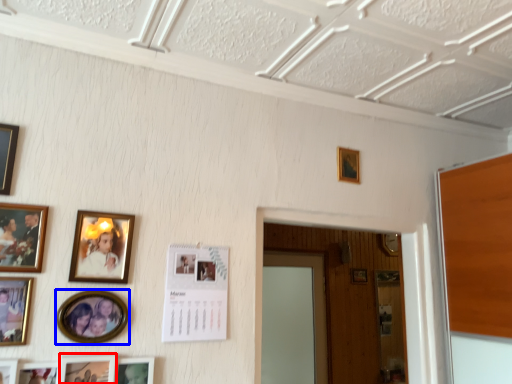
Question: Which of the following is the farthest to the observer, picture frame (highlighted by a red box) or picture frame (highlighted by a blue box)?

Choices:
 (A) picture frame
 (B) picture frame

Answer: (B)